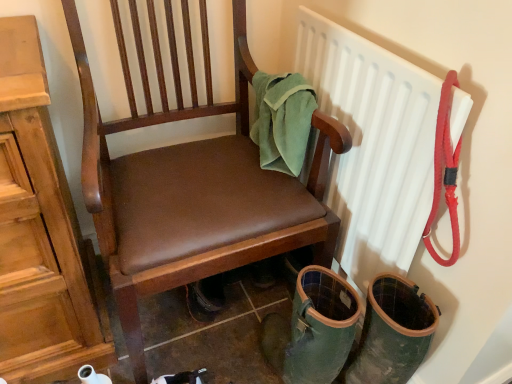
Question: From a real-world perspective, does brown leather chair at center sit lower than green felt towel at upper right?

Choices:
 (A) yes
 (B) no

Answer: (A)

Question: Is the depth of brown leather chair at center less than that of green felt towel at upper right?

Choices:
 (A) yes
 (B) no

Answer: (A)

Question: Is brown leather chair at center bigger than green felt towel at upper right?

Choices:
 (A) yes
 (B) no

Answer: (A)

Question: Can you confirm if brown leather chair at center is positioned to the right of green felt towel at upper right?

Choices:
 (A) no
 (B) yes

Answer: (A)

Question: Does brown leather chair at center have a smaller size compared to green felt towel at upper right?

Choices:
 (A) yes
 (B) no

Answer: (B)

Question: From a real-world perspective, relative to green felt towel at upper right, is white plastic radiator at upper right vertically above or below?

Choices:
 (A) below
 (B) above

Answer: (A)

Question: Considering the relative positions of white plastic radiator at upper right and green felt towel at upper right in the image provided, is white plastic radiator at upper right to the left or to the right of green felt towel at upper right?

Choices:
 (A) left
 (B) right

Answer: (B)

Question: From the image's perspective, relative to green felt towel at upper right, is white plastic radiator at upper right above or below?

Choices:
 (A) below
 (B) above

Answer: (A)

Question: In terms of height, does white plastic radiator at upper right look taller or shorter compared to green felt towel at upper right?

Choices:
 (A) tall
 (B) short

Answer: (A)

Question: From the image's perspective, is green felt towel at upper right located above or below white plastic radiator at upper right?

Choices:
 (A) above
 (B) below

Answer: (A)

Question: In the image, is green felt towel at upper right positioned in front of or behind white plastic radiator at upper right?

Choices:
 (A) front
 (B) behind

Answer: (B)

Question: Considering the positions of green felt towel at upper right and white plastic radiator at upper right in the image, is green felt towel at upper right taller or shorter than white plastic radiator at upper right?

Choices:
 (A) tall
 (B) short

Answer: (B)

Question: Would you say green felt towel at upper right is to the left or to the right of white plastic radiator at upper right in the picture?

Choices:
 (A) left
 (B) right

Answer: (A)

Question: Is brown leather chair at center bigger or smaller than green felt towel at upper right?

Choices:
 (A) big
 (B) small

Answer: (A)

Question: Considering their positions, is brown leather chair at center located in front of or behind green felt towel at upper right?

Choices:
 (A) front
 (B) behind

Answer: (A)